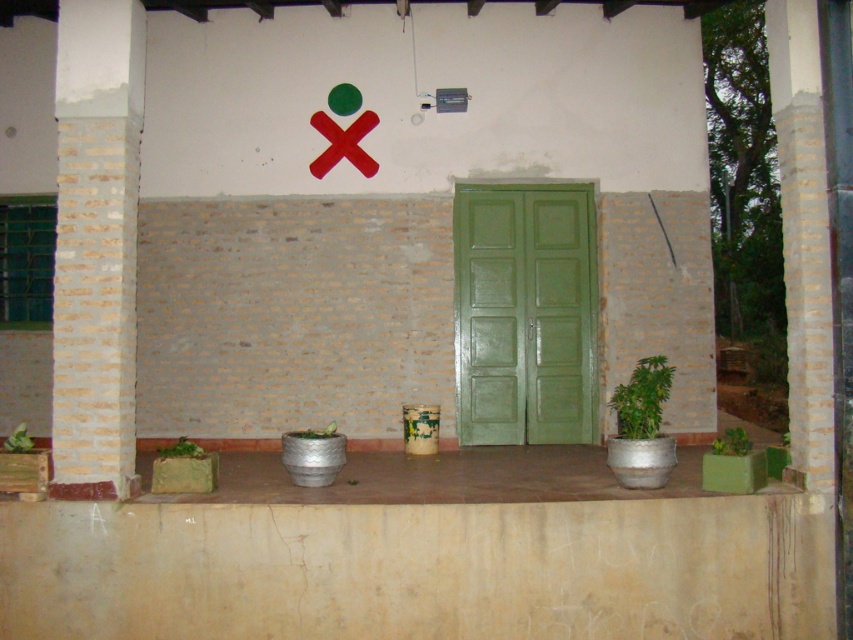
You are standing in front of the entrance and need to find the brick textured pillar at left. According to the coordinates provided, where exactly should you look to locate it?

The brick textured pillar at left is located at point (96, 246), so you should look to the left side of the entrance area at that coordinate position to find it.

You are standing in front of the entrance and want to place a new potted plant between the green metallic pot at right and the green metallic pot at lower left. Based on their positions, which pot should you position the new plant closer to in order to maintain symmetry?

To maintain symmetry, the new plant should be placed closer to the green metallic pot at lower left since it is farther from the viewer compared to the green metallic pot at right.

You are a delivery person trying to enter through the green painted wood door at center. There is a green metallic pot at lower right nearby. Can you lift the pot and place it in front of the door without needing to adjust its height?

The green painted wood door at center is taller than the green metallic pot at lower right, so yes, you can lift the green metallic pot at lower right and place it in front of the door without needing to adjust its height since the door is taller and won